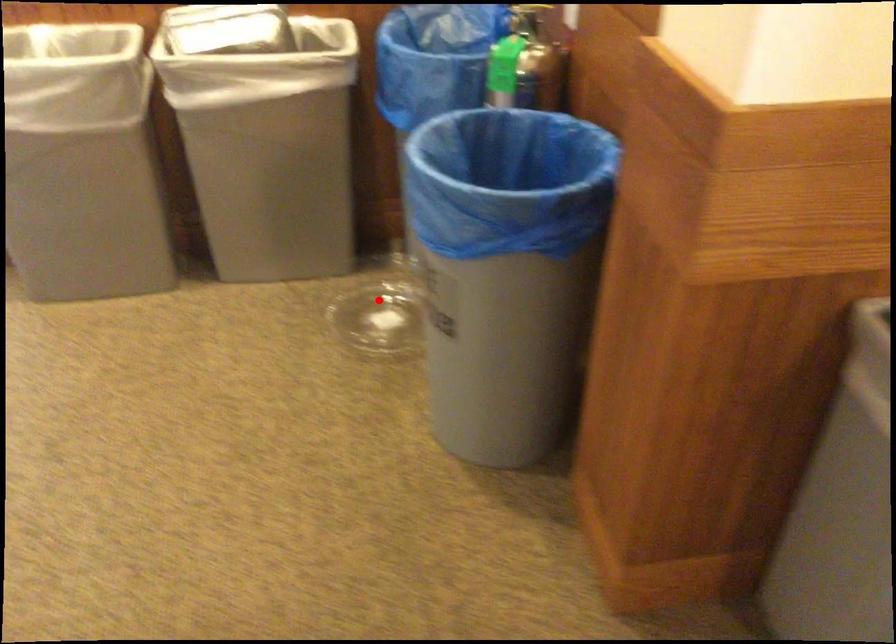
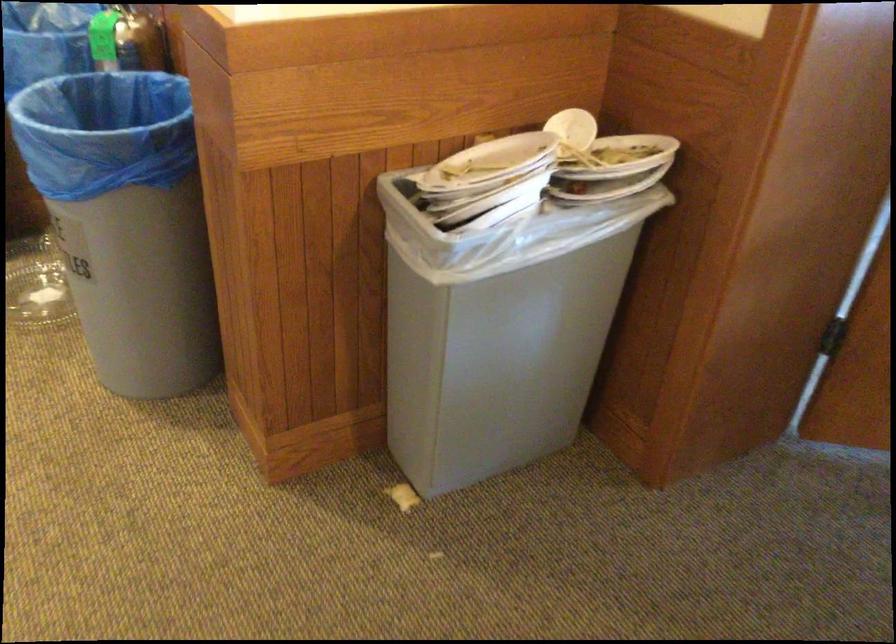
Where in the second image is the point corresponding to the highlighted location from the first image?

(36, 285)